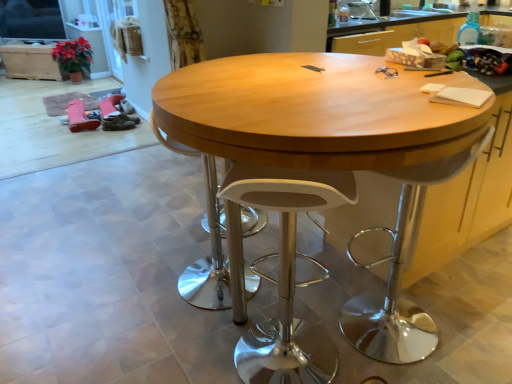
Where is `vacant region to the right of white plastic swivel chair at center, the first swivel chair when ordered from left to right`? vacant region to the right of white plastic swivel chair at center, the first swivel chair when ordered from left to right is located at coordinates (293, 286).